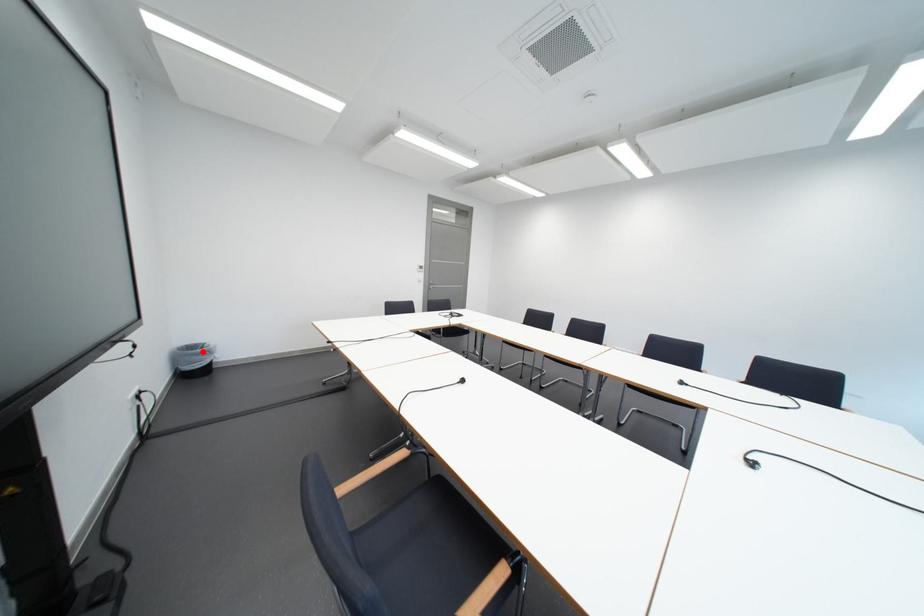
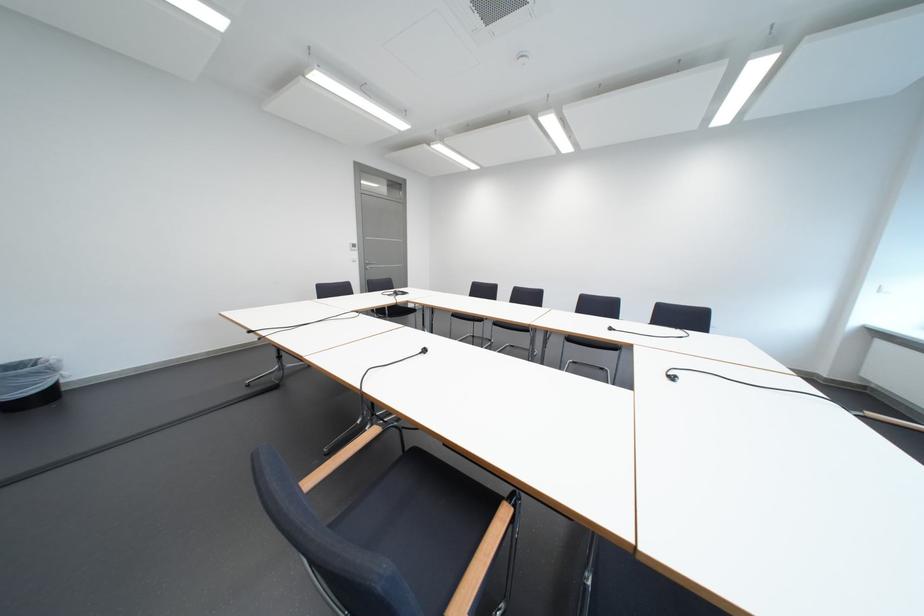
Question: I am providing you with two images of the same scene from different viewpoints. A red point is marked on the first image. Is the red point's position out of view in image 2?

Choices:
 (A) Yes
 (B) No

Answer: (B)